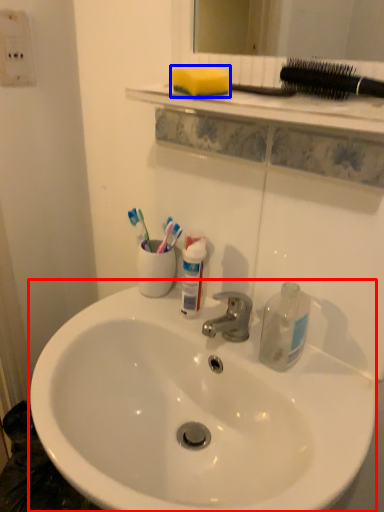
Question: Among these objects, which one is nearest to the camera, sink (highlighted by a red box) or soap (highlighted by a blue box)?

Choices:
 (A) sink
 (B) soap

Answer: (A)